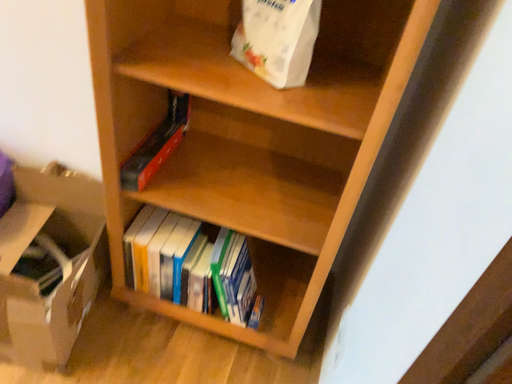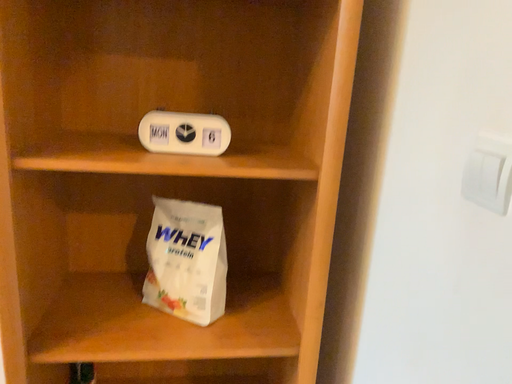
Question: Which way did the camera rotate in the video?

Choices:
 (A) rotated downward
 (B) rotated upward

Answer: (B)